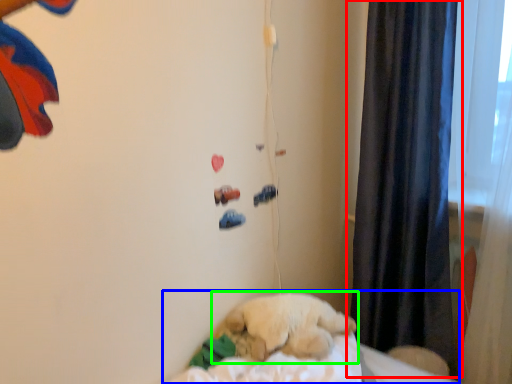
Question: Which is farther away from curtain (highlighted by a red box)? bed (highlighted by a blue box) or dog (highlighted by a green box)?

Choices:
 (A) bed
 (B) dog

Answer: (A)